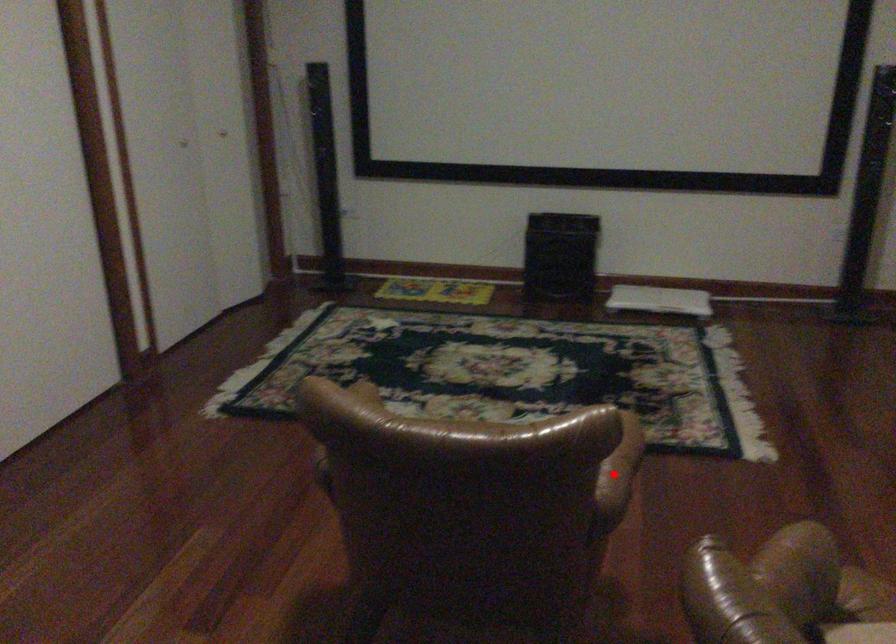
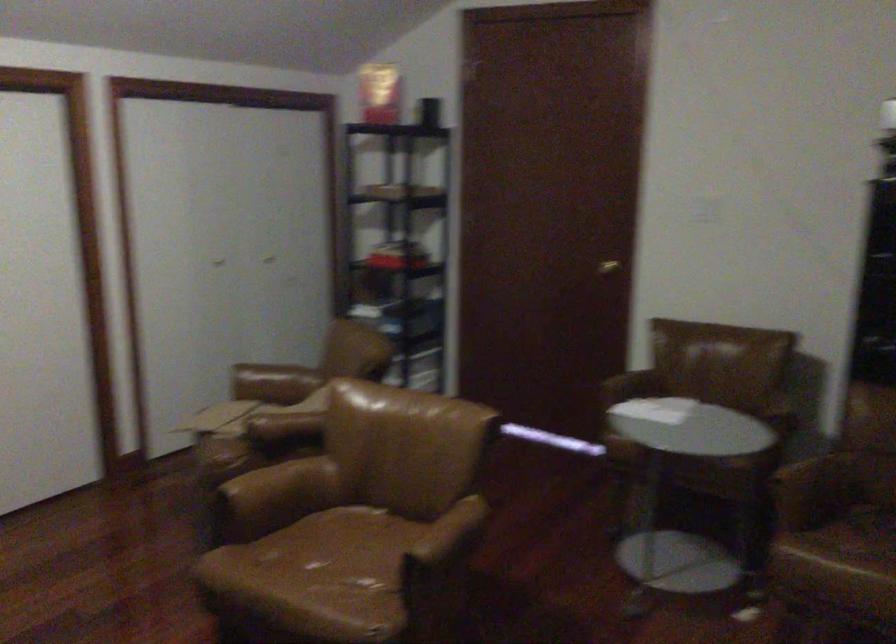
The point at the highlighted location is marked in the first image. Where is the corresponding point in the second image?

(280, 484)